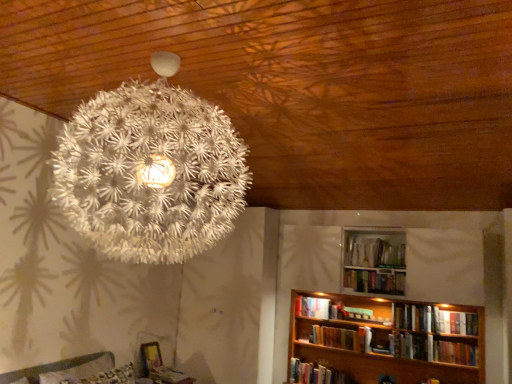
What do you see at coordinates (414, 317) in the screenshot?
I see `hardcover book at center, the seventh book from the left` at bounding box center [414, 317].

This screenshot has width=512, height=384. In order to click on hardcover book at center, the fourth book when ordered from right to left in this screenshot , I will do click(357, 313).

Measure the distance between hardcover book at center, which ranks as the 4th book in left-to-right order, and camera.

hardcover book at center, which ranks as the 4th book in left-to-right order, is 14.16 feet away from camera.

Image resolution: width=512 pixels, height=384 pixels. What do you see at coordinates (316, 374) in the screenshot?
I see `white matte bookshelf at lower right, the sixth book viewed from the right` at bounding box center [316, 374].

What is the approximate height of white matte bookshelf at lower right, the sixth book viewed from the right?

It is 9.73 inches.

The image size is (512, 384). Identify the location of wooden bookshelf at lower right. (386, 344).

How distant is wooden bookshelf at lower right from white matte bookshelf at lower right, arranged as the 7th book when viewed from the right?

wooden bookshelf at lower right is 23.89 inches away from white matte bookshelf at lower right, arranged as the 7th book when viewed from the right.

Considering the relative sizes of wooden bookshelf at lower right and white matte bookshelf at lower right, arranged as the 7th book when viewed from the right, in the image provided, is wooden bookshelf at lower right thinner than white matte bookshelf at lower right, arranged as the 7th book when viewed from the right,?

No.

Which is behind, point (435, 379) or point (297, 309)?

The point (297, 309) is farther from the camera.

Which object is closer to the camera taking this photo, wooden bookshelf at lower right or white matte bookshelf at lower right, which is the second book in left-to-right order?

wooden bookshelf at lower right is in front.

Considering the relative sizes of hardcover book at center, acting as the 2th book starting from the right, and hardcover book at upper right, positioned as the 1th book in right-to-left order, in the image provided, is hardcover book at center, acting as the 2th book starting from the right, thinner than hardcover book at upper right, positioned as the 1th book in right-to-left order,?

Correct, the width of hardcover book at center, acting as the 2th book starting from the right, is less than that of hardcover book at upper right, positioned as the 1th book in right-to-left order.

Does hardcover book at center, acting as the 2th book starting from the right, appear on the right side of hardcover book at upper right, positioned as the 1th book in right-to-left order?

In fact, hardcover book at center, acting as the 2th book starting from the right, is to the left of hardcover book at upper right, positioned as the 1th book in right-to-left order.

Does hardcover book at center, the seventh book from the left, contain hardcover book at upper right, positioned as the 1th book in right-to-left order?

No, hardcover book at upper right, positioned as the 1th book in right-to-left order, is not surrounded by hardcover book at center, the seventh book from the left.

Where is `book that is the 6th one below the white textured lamp at upper center (from a real-world perspective)`? The image size is (512, 384). book that is the 6th one below the white textured lamp at upper center (from a real-world perspective) is located at coordinates (335, 337).

Based on the photo, considering the sizes of hardcover book at center, which ranks as the 4th book in left-to-right order, and white textured lamp at upper center in the image, is hardcover book at center, which ranks as the 4th book in left-to-right order, wider or thinner than white textured lamp at upper center?

Considering their sizes, hardcover book at center, which ranks as the 4th book in left-to-right order, looks slimmer than white textured lamp at upper center.

Is hardcover book at center, the fifth book when ordered from right to left, at the right side of white textured lamp at upper center?

Yes.

Who is smaller, hardcover book at center, which ranks as the 4th book in left-to-right order, or white textured lamp at upper center?

hardcover book at center, which ranks as the 4th book in left-to-right order.

Which of these two, white matte bookshelf at lower right, arranged as the 7th book when viewed from the right, or wooden bookshelf at lower right, is smaller?

With smaller size is white matte bookshelf at lower right, arranged as the 7th book when viewed from the right.

From the picture: Is the surface of white matte bookshelf at lower right, arranged as the 7th book when viewed from the right, in direct contact with wooden bookshelf at lower right?

No, white matte bookshelf at lower right, arranged as the 7th book when viewed from the right, is not next to wooden bookshelf at lower right.

Considering the points (318, 312) and (483, 332), which point is behind, point (318, 312) or point (483, 332)?

Point (318, 312)

Measure the distance from white matte book at lower center, arranged as the eighth book when viewed from the right, to hardcover book at center, the fifth book when ordered from right to left.

white matte book at lower center, arranged as the eighth book when viewed from the right, and hardcover book at center, the fifth book when ordered from right to left, are 5.06 feet apart.

From the image's perspective, is white matte book at lower center, the first book positioned from the left, beneath hardcover book at center, which ranks as the 4th book in left-to-right order?

Yes, from the image's perspective, white matte book at lower center, the first book positioned from the left, is below hardcover book at center, which ranks as the 4th book in left-to-right order.

Considering the sizes of white matte book at lower center, the first book positioned from the left, and hardcover book at center, which ranks as the 4th book in left-to-right order, in the image, is white matte book at lower center, the first book positioned from the left, taller or shorter than hardcover book at center, which ranks as the 4th book in left-to-right order,?

Considering their sizes, white matte book at lower center, the first book positioned from the left, has less height than hardcover book at center, which ranks as the 4th book in left-to-right order.

Does point (157, 370) come behind point (317, 331)?

No.

Considering the sizes of objects white matte bookshelf at lower right, arranged as the 7th book when viewed from the right, and hardcover book at center, the fifth book when ordered from right to left, in the image provided, who is smaller, white matte bookshelf at lower right, arranged as the 7th book when viewed from the right, or hardcover book at center, the fifth book when ordered from right to left,?

white matte bookshelf at lower right, arranged as the 7th book when viewed from the right, is smaller.

Is white matte bookshelf at lower right, which is the second book in left-to-right order, not near hardcover book at center, which ranks as the 4th book in left-to-right order?

They are positioned close to each other.

How many degrees apart are the facing directions of white matte bookshelf at lower right, arranged as the 7th book when viewed from the right, and hardcover book at center, the fifth book when ordered from right to left?

The facing directions of white matte bookshelf at lower right, arranged as the 7th book when viewed from the right, and hardcover book at center, the fifth book when ordered from right to left, are 0.00288 degrees apart.

From the image's perspective, which is below, white matte bookshelf at lower right, arranged as the 7th book when viewed from the right, or hardcover book at center, the fifth book when ordered from right to left?

From the image's view, hardcover book at center, the fifth book when ordered from right to left, is below.

Is hardcover books at upper center, the 3th book in the right-to-left sequence, not inside white matte bookshelf at lower right, arranged as the 7th book when viewed from the right?

hardcover books at upper center, the 3th book in the right-to-left sequence, is positioned outside white matte bookshelf at lower right, arranged as the 7th book when viewed from the right.

From a real-world perspective, which is physically below, hardcover books at upper center, which is counted as the 6th book, starting from the left, or white matte bookshelf at lower right, arranged as the 7th book when viewed from the right?

white matte bookshelf at lower right, arranged as the 7th book when viewed from the right, from a real-world perspective.

Which is nearer, (362, 276) or (328, 312)?

Point (362, 276).

I want to click on the 4th book positioned above the white matte bookshelf at lower right, which is the second book in left-to-right order (from the image's perspective), so click(375, 281).

Where is `bookcase in front of the white matte bookshelf at lower right, arranged as the 7th book when viewed from the right`? bookcase in front of the white matte bookshelf at lower right, arranged as the 7th book when viewed from the right is located at coordinates (386, 344).

From the image's perspective, which book is the 1st one below the hardcover book at upper right, which is the 8th book from left to right? Please provide its 2D coordinates.

[(414, 317)]

Estimate the real-world distances between objects in this image. Which object is closer to hardcover books at upper center, the 3th book in the right-to-left sequence, wooden bookshelf at lower right or white matte book at lower center, the first book positioned from the left?

wooden bookshelf at lower right is positioned closer to the anchor hardcover books at upper center, the 3th book in the right-to-left sequence.

In the scene shown: When comparing their distances from hardcover book at center, acting as the 2th book starting from the right, does hardcover books at upper center, which is counted as the 6th book, starting from the left, or white matte book at lower center, arranged as the eighth book when viewed from the right, seem closer?

The object closer to hardcover book at center, acting as the 2th book starting from the right, is hardcover books at upper center, which is counted as the 6th book, starting from the left.

Based on their spatial positions, is white matte bookshelf at lower right, the 3th book positioned from the left, or hardcover books at upper center, which is counted as the 6th book, starting from the left, closer to hardcover book at upper right, which is the 8th book from left to right?

Among the two, hardcover books at upper center, which is counted as the 6th book, starting from the left, is located nearer to hardcover book at upper right, which is the 8th book from left to right.

Considering their positions, is hardcover book at center, arranged as the fifth book when viewed from the left, positioned closer to white matte bookshelf at lower right, the 3th book positioned from the left, than hardcover books at upper center, the 3th book in the right-to-left sequence?

hardcover book at center, arranged as the fifth book when viewed from the left.

Based on their spatial positions, is white matte book at lower center, arranged as the eighth book when viewed from the right, or hardcover books at upper center, which is counted as the 6th book, starting from the left, closer to white textured lamp at upper center?

Among the two, hardcover books at upper center, which is counted as the 6th book, starting from the left, is located nearer to white textured lamp at upper center.

When comparing their distances from white matte bookshelf at lower right, the 3th book positioned from the left, does hardcover book at center, which ranks as the 4th book in left-to-right order, or hardcover book at center, the fourth book when ordered from right to left, seem further?

hardcover book at center, the fourth book when ordered from right to left, is positioned further to the anchor white matte bookshelf at lower right, the 3th book positioned from the left.

When comparing their distances from hardcover books at upper center, which is counted as the 6th book, starting from the left, does hardcover book at center, the seventh book from the left, or hardcover book at center, which ranks as the 4th book in left-to-right order, seem closer?

The object closer to hardcover books at upper center, which is counted as the 6th book, starting from the left, is hardcover book at center, the seventh book from the left.

When comparing their distances from wooden bookshelf at lower right, does hardcover book at center, acting as the 2th book starting from the right, or hardcover book at center, the fourth book when ordered from right to left, seem further?

The object further to wooden bookshelf at lower right is hardcover book at center, the fourth book when ordered from right to left.

The height and width of the screenshot is (384, 512). I want to click on book between hardcover book at center, the fourth book when ordered from right to left, and hardcover book at center, acting as the 2th book starting from the right, from left to right, so click(375, 281).

You are a GUI agent. You are given a task and a screenshot of the screen. Output one action in this format:
    pyautogui.click(x=<x>, y=<y>)
    Task: Click on the bookcase between white textured lamp at upper center and white matte book at lower center, the first book positioned from the left, along the z-axis
    The height and width of the screenshot is (384, 512).
    Given the screenshot: What is the action you would take?
    pyautogui.click(x=386, y=344)

Find the location of a particular element. This screenshot has height=384, width=512. book located between white matte book at lower center, the first book positioned from the left, and white matte bookshelf at lower right, the sixth book viewed from the right, in the left-right direction is located at coordinates (312, 307).

Locate an element on the screen. bookcase between hardcover book at center, the fourth book when ordered from right to left, and hardcover book at upper right, positioned as the 1th book in right-to-left order, from left to right is located at coordinates (386, 344).